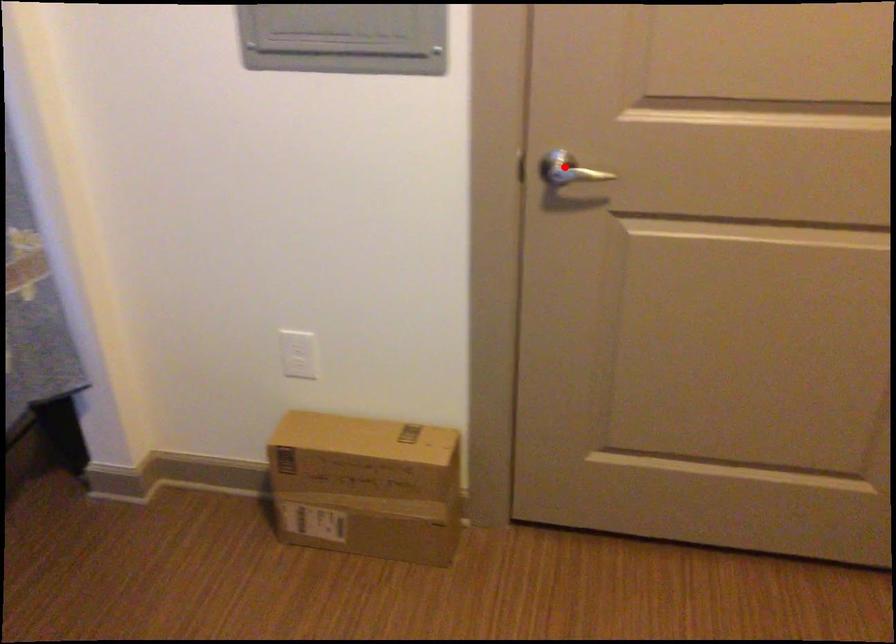
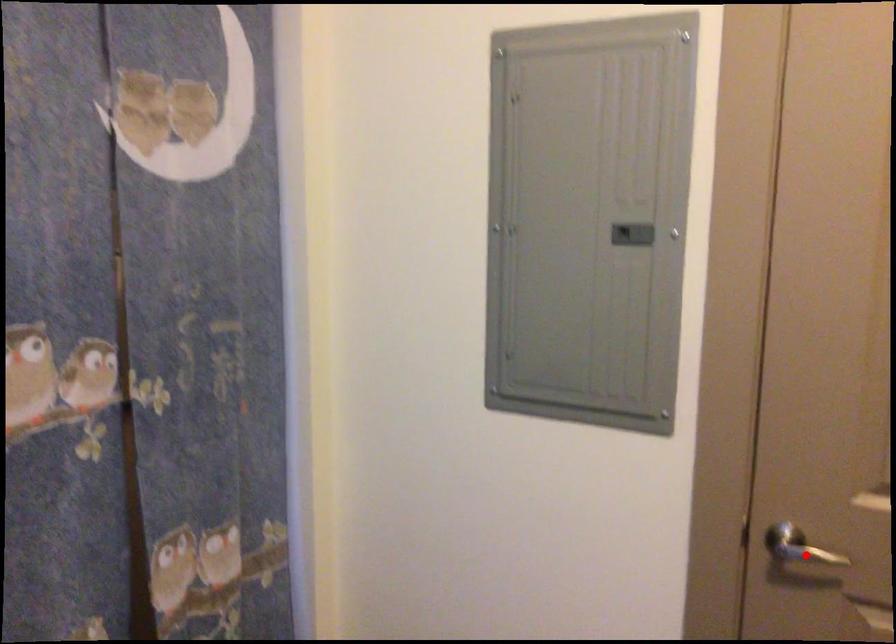
I am providing you with two images of the same scene from different viewpoints. A red point is marked on the first image and another point is marked on the second image. Are the points marked in image1 and image2 representing the same 3D position?

Yes